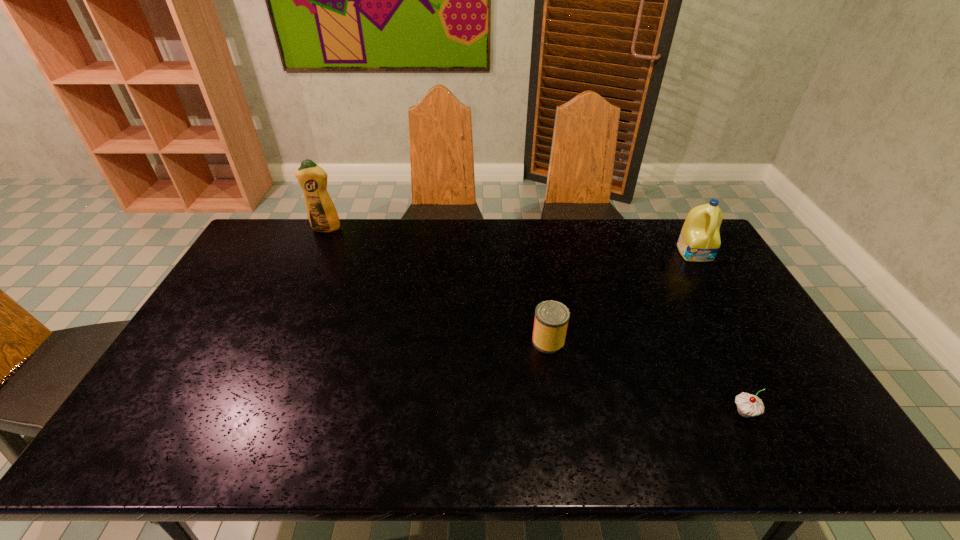
You are a GUI agent. You are given a task and a screenshot of the screen. Output one action in this format:
    pyautogui.click(x=<x>, y=<y>)
    Task: Click on the free space located 0.230m on the right of the second shortest object
    
    Given the screenshot: What is the action you would take?
    pyautogui.click(x=645, y=341)

The height and width of the screenshot is (540, 960). Find the location of `vacant space situated 0.070m on the right of the cupcake`. vacant space situated 0.070m on the right of the cupcake is located at coordinates (786, 413).

Where is `detergent positioned at the right edge`? The image size is (960, 540). detergent positioned at the right edge is located at coordinates (699, 241).

At what (x,y) coordinates should I click in order to perform the action: click on cupcake that is at the right edge. Please return your answer as a coordinate pair (x, y). This screenshot has height=540, width=960. Looking at the image, I should click on (748, 405).

Find the location of `object positioned at the far right corner`. object positioned at the far right corner is located at coordinates (699, 241).

In order to click on vacant space at the far edge of the desktop in this screenshot , I will do `click(342, 226)`.

Identify the location of blank space at the near edge of the desktop. pyautogui.click(x=334, y=433).

Identify the location of vacant region at the left edge of the desktop. The height and width of the screenshot is (540, 960). (179, 410).

Identify the location of blank space at the right edge. (702, 296).

You are a GUI agent. You are given a task and a screenshot of the screen. Output one action in this format:
    pyautogui.click(x=<x>, y=<y>)
    Task: Click on the free space between the third tallest object and the tallest object
    
    Given the screenshot: What is the action you would take?
    pyautogui.click(x=437, y=285)